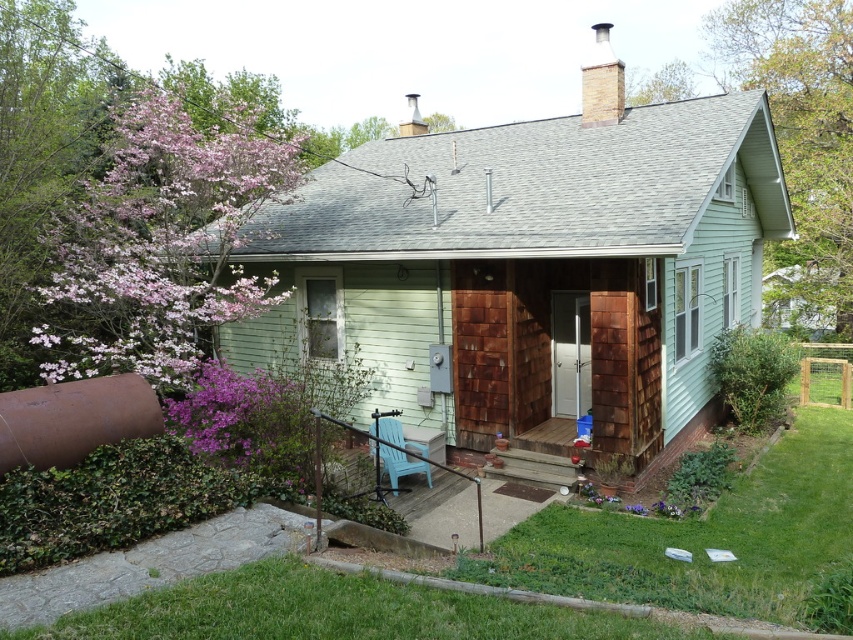
You are a landscape designer planning to add a new flower bed between the pink bloom at upper left and the rustic wood porch at lower center. Since you want the flower bed to be wider than both existing elements, which one of the two should you use as a reference for the minimum width of the flower bed?

The pink bloom at upper left has a lesser width compared to rustic wood porch at lower center, so you should use the rustic wood porch at lower center as the reference for the minimum width of the flower bed to ensure it is wider than both.

You are standing in front of the house and notice two points marked in the image. The first point is at coordinate point (144, 296) and the second is at coordinate point (517, 451). Which point is closer to you?

Point (144, 296) is closer to the viewer than point (517, 451).

You are standing in front of the house and want to touch both the light green siding at center and the rustic wood porch at lower center. Which one can you reach without moving your feet?

The rustic wood porch at lower center can be reached without moving your feet because it is closer to you than the light green siding at center, which is further away.